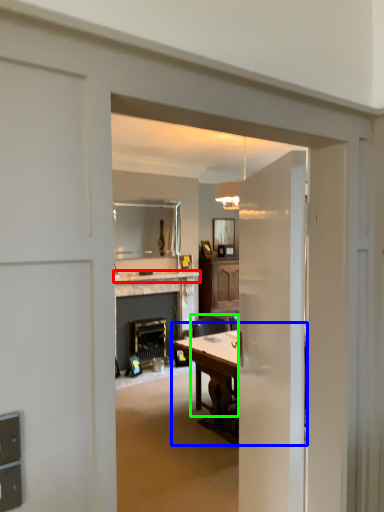
Question: Which is farther away from counter top (highlighted by a red box)? table (highlighted by a blue box) or chair (highlighted by a green box)?

Choices:
 (A) table
 (B) chair

Answer: (A)